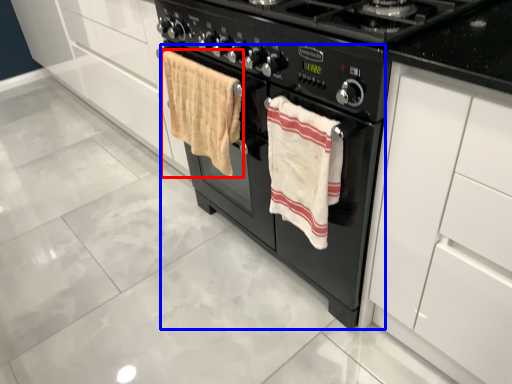
Question: Among these objects, which one is farthest to the camera, beach towel (highlighted by a red box) or oven (highlighted by a blue box)?

Choices:
 (A) beach towel
 (B) oven

Answer: (A)